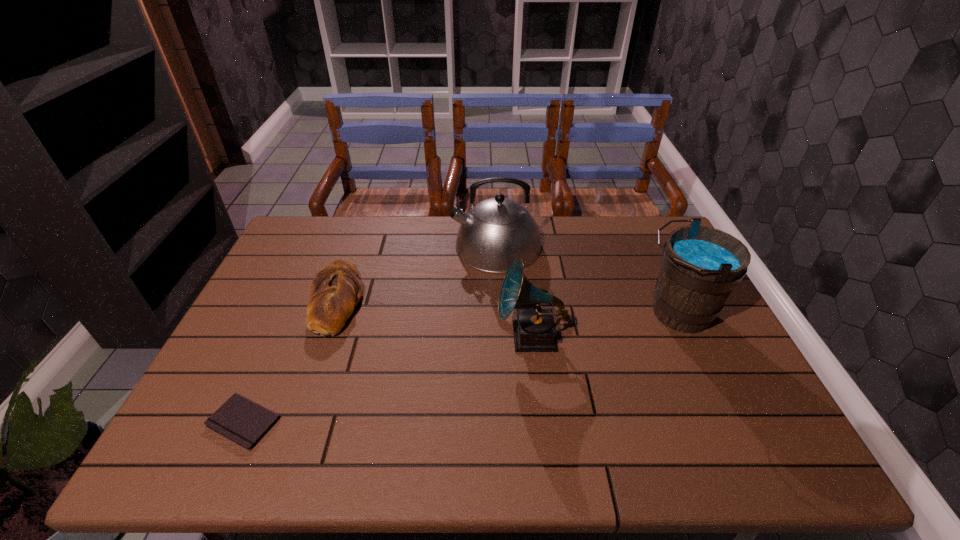
The height and width of the screenshot is (540, 960). I want to click on free area in between the phonograph_record and the wine bucket, so click(x=604, y=325).

Where is `empty location between the wine bucket and the phonograph_record`? empty location between the wine bucket and the phonograph_record is located at coordinates (604, 325).

Identify which object is located as the second nearest to the kettle. Please provide its 2D coordinates. Your answer should be formatted as a tuple, i.e. [(x, y)], where the tuple contains the x and y coordinates of a point satisfying the conditions above.

[(700, 266)]

Identify the location of object that stands as the third closest to the wine bucket. (335, 291).